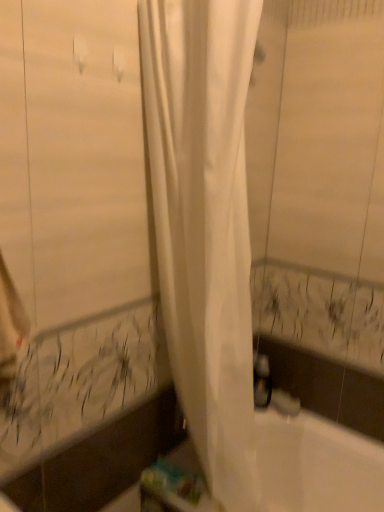
Find the location of a particular element. Image resolution: width=384 pixels, height=512 pixels. satin silver faucet at lower center is located at coordinates (284, 403).

This screenshot has height=512, width=384. What do you see at coordinates (284, 403) in the screenshot? I see `satin silver faucet at lower center` at bounding box center [284, 403].

The height and width of the screenshot is (512, 384). I want to click on satin silver faucet at lower center, so click(284, 403).